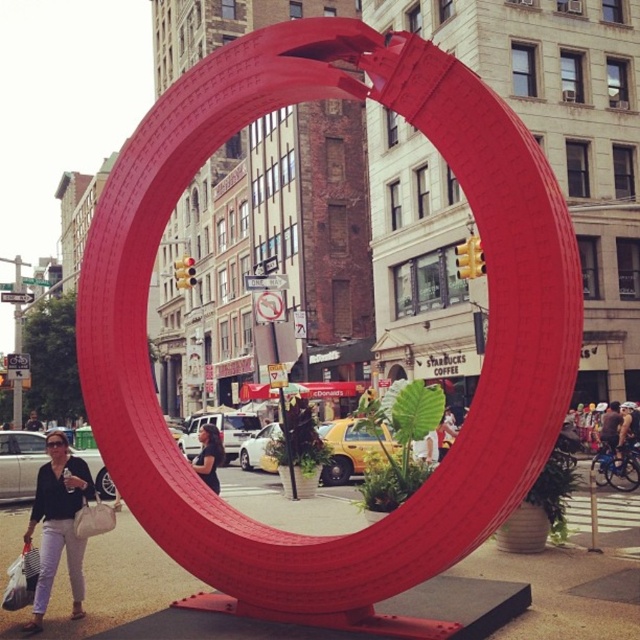
Question: Is matte red sculpture at center in front of matte black shirt at lower left?

Choices:
 (A) no
 (B) yes

Answer: (B)

Question: Which object is farther from the camera taking this photo?

Choices:
 (A) matte black shirt at center
 (B) matte black shirt at lower left

Answer: (A)

Question: Which of the following is the farthest from the observer?

Choices:
 (A) (314, 580)
 (B) (56, 552)
 (C) (212, 436)

Answer: (C)

Question: Where is matte red sculpture at center located in relation to matte black shirt at lower left in the image?

Choices:
 (A) right
 (B) left

Answer: (A)

Question: Which is nearer to the matte black shirt at center?

Choices:
 (A) matte red sculpture at center
 (B) matte black shirt at lower left

Answer: (B)

Question: Is matte red sculpture at center wider than matte black shirt at center?

Choices:
 (A) no
 (B) yes

Answer: (B)